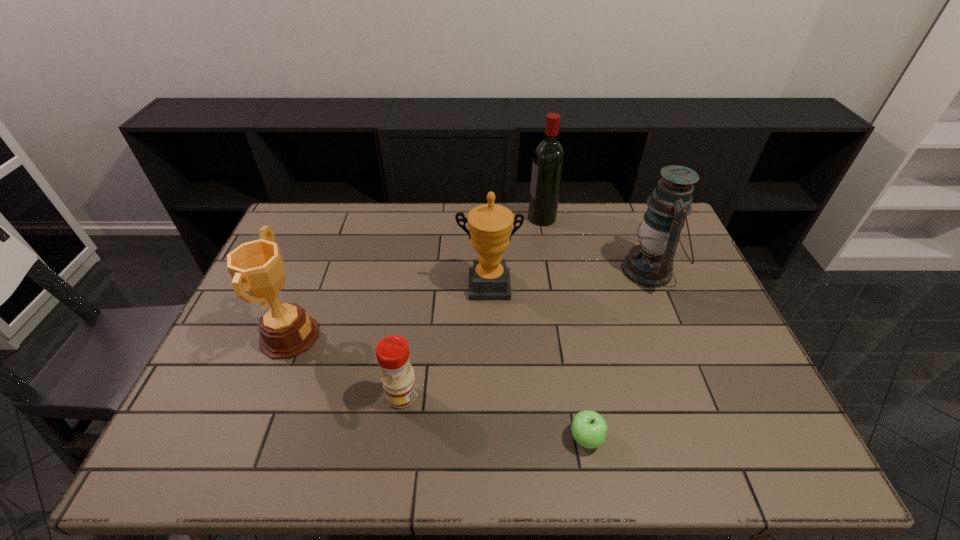
Find the location of a particular element. blank space that satisfies the following two spatial constraints: 1. on the back side of the apple; 2. on the label of the wine bottle is located at coordinates (546, 218).

Where is `free region that satisfies the following two spatial constraints: 1. on the front-facing side of the shortest object; 2. on the left side of the nearer award`? Image resolution: width=960 pixels, height=540 pixels. free region that satisfies the following two spatial constraints: 1. on the front-facing side of the shortest object; 2. on the left side of the nearer award is located at coordinates (250, 438).

What are the coordinates of `blank area in the image that satisfies the following two spatial constraints: 1. at the front of the farther award with handles; 2. on the front-facing side of the third nearest object` in the screenshot? It's located at (490, 336).

Where is `vacant space that satisfies the following two spatial constraints: 1. on the back side of the fifth farthest object; 2. on the front-facing side of the left award`? The width and height of the screenshot is (960, 540). vacant space that satisfies the following two spatial constraints: 1. on the back side of the fifth farthest object; 2. on the front-facing side of the left award is located at coordinates (411, 336).

Find the location of a particular element. Image resolution: width=960 pixels, height=540 pixels. vacant space that satisfies the following two spatial constraints: 1. on the front-facing side of the left award; 2. on the left side of the nearest object is located at coordinates (250, 438).